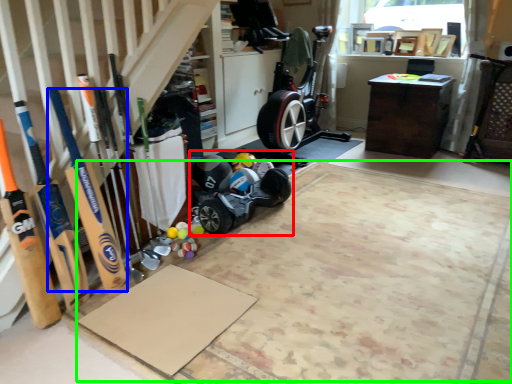
Question: Which object is the closest to the baby carriage (highlighted by a red box)? Choose among these: baseball bat (highlighted by a blue box) or yoga mat (highlighted by a green box).

Choices:
 (A) baseball bat
 (B) yoga mat

Answer: (B)